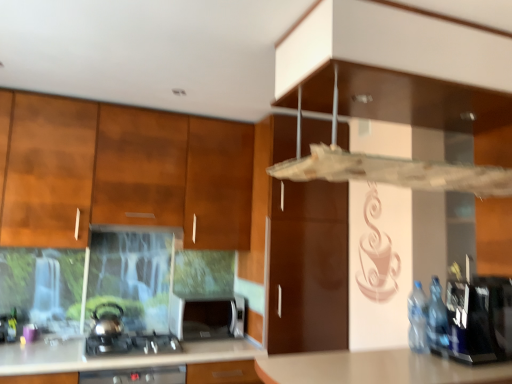
Question: Is satin silver kettle at lower left at the back of satin black gas stove at lower left?

Choices:
 (A) no
 (B) yes

Answer: (A)

Question: Is satin black gas stove at lower left at the right side of satin silver kettle at lower left?

Choices:
 (A) no
 (B) yes

Answer: (B)

Question: Does satin black gas stove at lower left have a lesser height compared to satin silver kettle at lower left?

Choices:
 (A) no
 (B) yes

Answer: (B)

Question: Is satin black gas stove at lower left far from satin silver kettle at lower left?

Choices:
 (A) yes
 (B) no

Answer: (B)

Question: Considering the relative positions of satin black gas stove at lower left and satin silver kettle at lower left in the image provided, is satin black gas stove at lower left to the left of satin silver kettle at lower left from the viewer's perspective?

Choices:
 (A) no
 (B) yes

Answer: (A)

Question: Considering the relative sizes of satin black gas stove at lower left and satin silver kettle at lower left in the image provided, is satin black gas stove at lower left wider than satin silver kettle at lower left?

Choices:
 (A) yes
 (B) no

Answer: (A)

Question: Is the position of blue plastic bottles at right more distant than that of satin black gas stove at lower left?

Choices:
 (A) no
 (B) yes

Answer: (A)

Question: Does blue plastic bottles at right have a smaller size compared to satin black gas stove at lower left?

Choices:
 (A) no
 (B) yes

Answer: (A)

Question: Would you say blue plastic bottles at right contains satin black gas stove at lower left?

Choices:
 (A) yes
 (B) no

Answer: (B)

Question: From the image's perspective, is blue plastic bottles at right on top of satin black gas stove at lower left?

Choices:
 (A) yes
 (B) no

Answer: (A)

Question: Is blue plastic bottles at right wider than satin black gas stove at lower left?

Choices:
 (A) yes
 (B) no

Answer: (B)

Question: From a real-world perspective, does blue plastic bottles at right sit lower than satin black gas stove at lower left?

Choices:
 (A) yes
 (B) no

Answer: (B)

Question: Does transparent plastic vent at upper center appear on the left side of wooden cabinet at left?

Choices:
 (A) no
 (B) yes

Answer: (A)